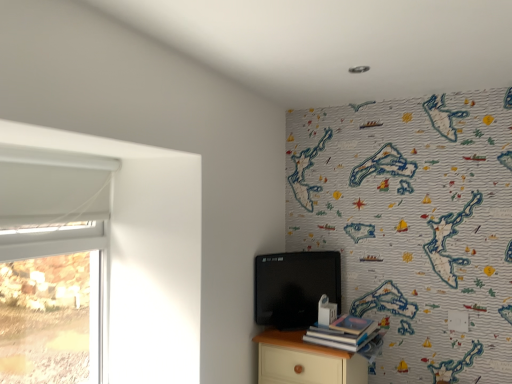
Question: From the image's perspective, relative to hardcover book at lower right, is light wood nightstand at lower right above or below?

Choices:
 (A) below
 (B) above

Answer: (A)

Question: Would you say light wood nightstand at lower right is to the left or to the right of hardcover book at lower right in the picture?

Choices:
 (A) left
 (B) right

Answer: (A)

Question: Which object is positioned farthest from the matte black tv at center?

Choices:
 (A) white plastic window at left
 (B) hardcover book at lower right
 (C) light wood nightstand at lower right

Answer: (A)

Question: Which object is the farthest from the light wood nightstand at lower right?

Choices:
 (A) hardcover book at lower right
 (B) white plastic window at left
 (C) matte black tv at center

Answer: (B)